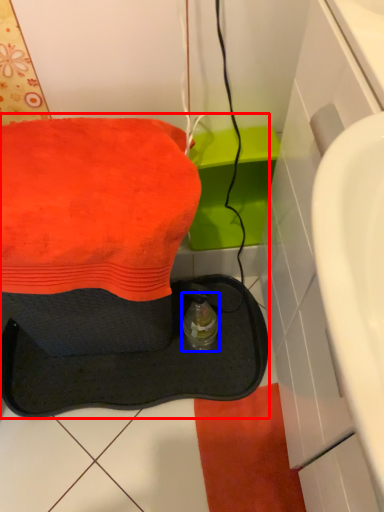
Question: Which point is further to the camera, sink (highlighted by a red box) or bottle (highlighted by a blue box)?

Choices:
 (A) sink
 (B) bottle

Answer: (B)